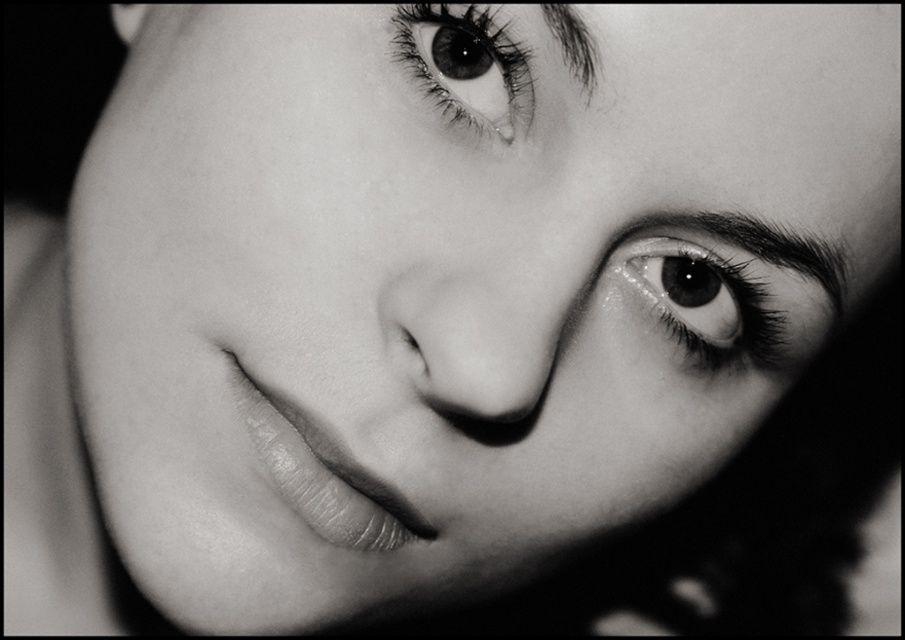
Who is more distant from viewer, (421, 64) or (834, 317)?

The point (834, 317) is behind.

Is smooth skin eye at upper center shorter than black smooth eyebrow at upper right?

In fact, smooth skin eye at upper center may be taller than black smooth eyebrow at upper right.

Between point (484, 48) and point (648, 216), which one is positioned in front?

Point (648, 216) is more forward.

You are a GUI agent. You are given a task and a screenshot of the screen. Output one action in this format:
    pyautogui.click(x=<x>, y=<y>)
    Task: Click on the smooth skin eye at upper center
    
    Given the screenshot: What is the action you would take?
    pyautogui.click(x=467, y=65)

Between glossy black eye at upper right and dark hair at upper right, which one appears on the right side from the viewer's perspective?

Positioned to the right is glossy black eye at upper right.

Find the location of a particular element. The width and height of the screenshot is (905, 640). glossy black eye at upper right is located at coordinates (705, 304).

Is point (678, 326) positioned after point (576, 72)?

Yes, it is.

The image size is (905, 640). I want to click on glossy black eye at upper right, so click(x=705, y=304).

Does point (829, 298) come in front of point (579, 61)?

No.

Who is positioned more to the left, black smooth eyebrow at upper right or dark hair at upper right?

dark hair at upper right

The height and width of the screenshot is (640, 905). Describe the element at coordinates (765, 246) in the screenshot. I see `black smooth eyebrow at upper right` at that location.

Where is `black smooth eyebrow at upper right`? This screenshot has height=640, width=905. black smooth eyebrow at upper right is located at coordinates (765, 246).